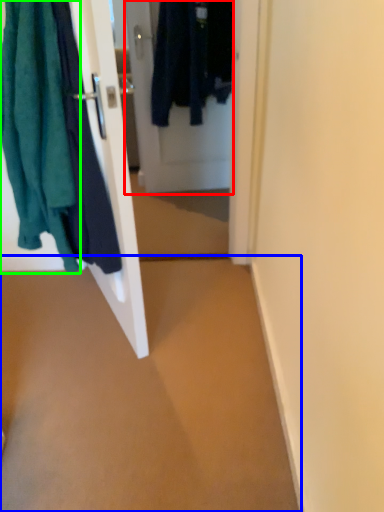
Question: Which object is positioned closest to door (highlighted by a red box)? Select from plain (highlighted by a blue box) and towel (highlighted by a green box).

Choices:
 (A) plain
 (B) towel

Answer: (B)